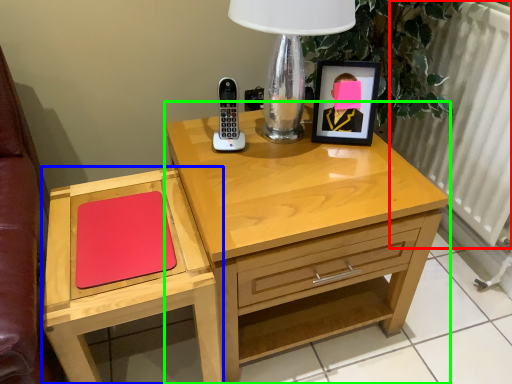
Question: Considering the real-world distances, which object is closest to radiator (highlighted by a red box)? chest of drawers (highlighted by a blue box) or nightstand (highlighted by a green box).

Choices:
 (A) chest of drawers
 (B) nightstand

Answer: (B)